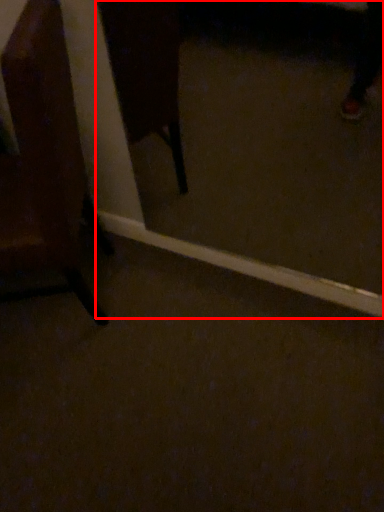
Question: Where is glass door (annotated by the red box) located in relation to chair in the image?

Choices:
 (A) right
 (B) left

Answer: (A)